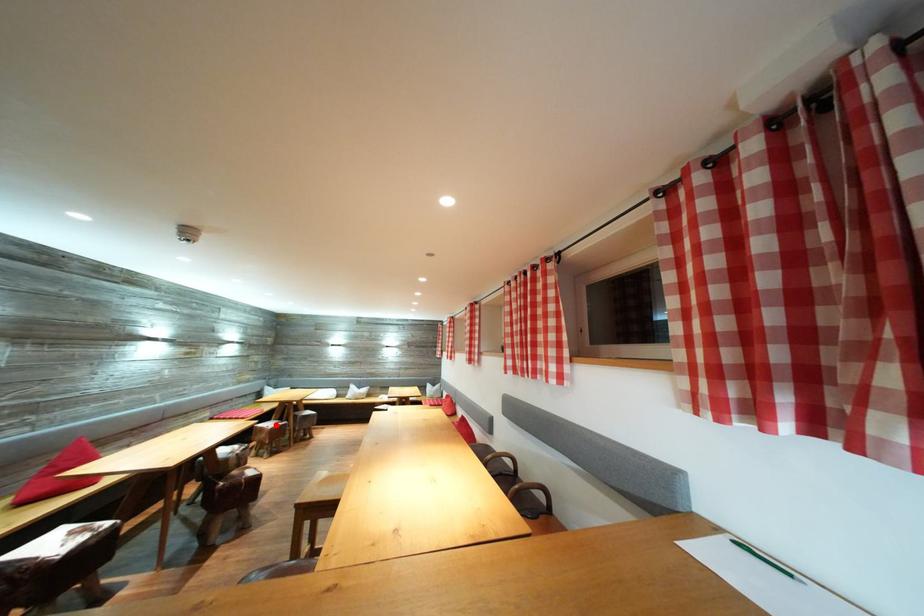
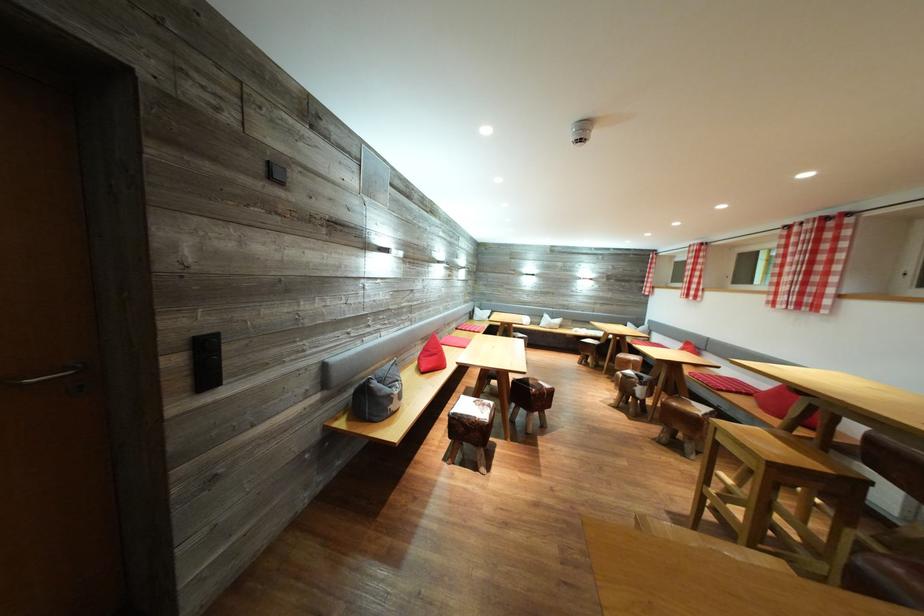
Question: I am providing you with two images of the same scene from different viewpoints. A red point is marked on the first image. Can you still see the location of the red point in image 2?

Choices:
 (A) Yes
 (B) No

Answer: (B)